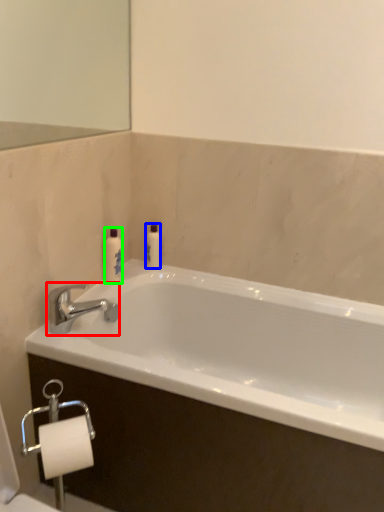
Question: Which object is positioned closest to tap (highlighted by a red box)? Select from toiletry (highlighted by a blue box) and toiletry (highlighted by a green box).

Choices:
 (A) toiletry
 (B) toiletry

Answer: (B)